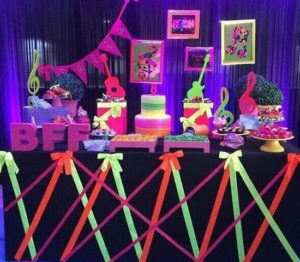
Where is `ribbon`? ribbon is located at coordinates (60, 153).